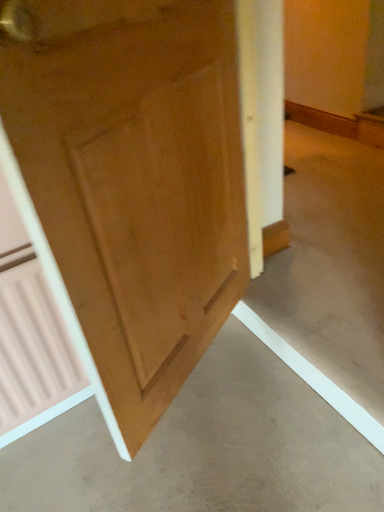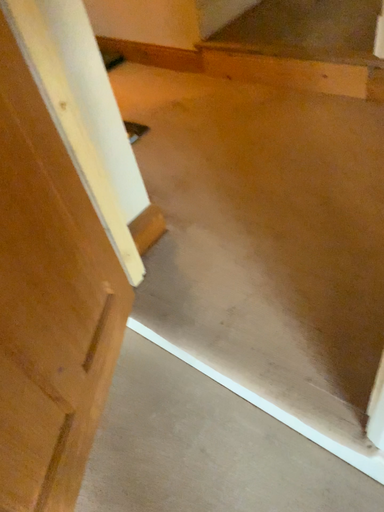
Question: Which way did the camera rotate in the video?

Choices:
 (A) rotated right
 (B) rotated left

Answer: (A)